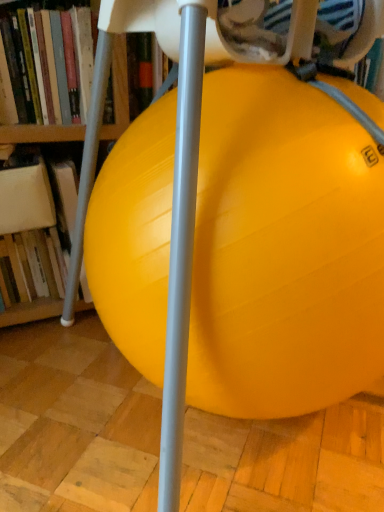
Question: In terms of height, does yellow rubber ball at center look taller or shorter compared to hardcover book at left, positioned as the 1th book in bottom-to-top order?

Choices:
 (A) tall
 (B) short

Answer: (A)

Question: Based on their positions, is yellow rubber ball at center located to the left or right of hardcover book at left, positioned as the 1th book in bottom-to-top order?

Choices:
 (A) left
 (B) right

Answer: (B)

Question: Which object is the closest to the hardcover book at left, which is the first book from top to bottom?

Choices:
 (A) yellow rubber ball at center
 (B) hardcover book at left, positioned as the 1th book in bottom-to-top order

Answer: (B)

Question: Estimate the real-world distances between objects in this image. Which object is closer to the yellow rubber ball at center?

Choices:
 (A) hardcover book at left, which ranks as the 2th book in bottom-to-top order
 (B) hardcover book at left, positioned as the 1th book in bottom-to-top order

Answer: (A)